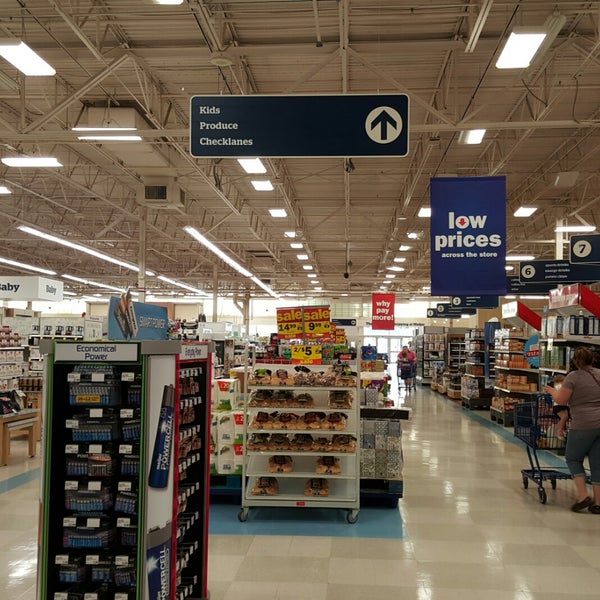
What are the coordinates of `lit light that is farthest right` in the screenshot? It's located at (585, 225).